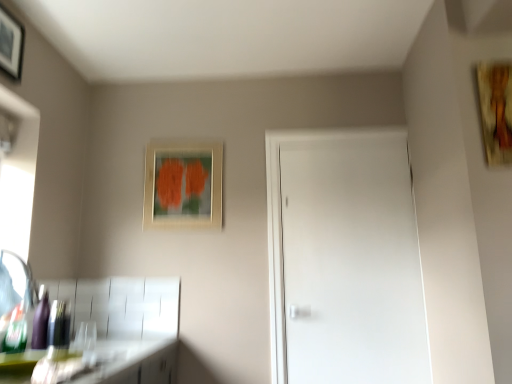
Question: From a real-world perspective, is brushed metal faucet at lower left physically above wooden picture frame at upper left, placed as the first picture frame when sorted from left to right?

Choices:
 (A) no
 (B) yes

Answer: (A)

Question: Considering the relative sizes of brushed metal faucet at lower left and wooden picture frame at upper left, the 3th picture frame positioned from the right, in the image provided, is brushed metal faucet at lower left bigger than wooden picture frame at upper left, the 3th picture frame positioned from the right,?

Choices:
 (A) no
 (B) yes

Answer: (B)

Question: Is brushed metal faucet at lower left directly adjacent to wooden picture frame at upper left, placed as the first picture frame when sorted from left to right?

Choices:
 (A) yes
 (B) no

Answer: (B)

Question: From the image's perspective, would you say brushed metal faucet at lower left is shown under wooden picture frame at upper left, which appears as the second picture frame when viewed from the back?

Choices:
 (A) yes
 (B) no

Answer: (A)

Question: Is brushed metal faucet at lower left outside of wooden picture frame at upper left, which appears as the second picture frame when viewed from the back?

Choices:
 (A) no
 (B) yes

Answer: (B)

Question: Does point (193, 211) appear closer or farther from the camera than point (270, 140)?

Choices:
 (A) closer
 (B) farther

Answer: (A)

Question: Which is correct: matte wooden picture frame at upper center, which appears as the second picture frame when viewed from the right, is inside white matte door at center, or outside of it?

Choices:
 (A) inside
 (B) outside

Answer: (B)

Question: From a real-world perspective, is matte wooden picture frame at upper center, placed as the 1th picture frame when sorted from back to front, physically located above or below white matte door at center?

Choices:
 (A) above
 (B) below

Answer: (A)

Question: From their relative heights in the image, would you say matte wooden picture frame at upper center, which appears as the second picture frame when viewed from the right, is taller or shorter than white matte door at center?

Choices:
 (A) short
 (B) tall

Answer: (A)

Question: Considering the positions of brushed metal faucet at lower left and wooden textured painting at upper right, arranged as the first picture frame when viewed from the right, in the image, is brushed metal faucet at lower left wider or thinner than wooden textured painting at upper right, arranged as the first picture frame when viewed from the right,?

Choices:
 (A) wide
 (B) thin

Answer: (A)

Question: From a real-world perspective, relative to wooden textured painting at upper right, which appears as the third picture frame when viewed from the left, is brushed metal faucet at lower left vertically above or below?

Choices:
 (A) below
 (B) above

Answer: (A)

Question: Would you say brushed metal faucet at lower left is to the left or to the right of wooden textured painting at upper right, arranged as the first picture frame when viewed from the right, in the picture?

Choices:
 (A) left
 (B) right

Answer: (A)

Question: In the image, is brushed metal faucet at lower left positioned in front of or behind wooden textured painting at upper right, arranged as the first picture frame when viewed from the right?

Choices:
 (A) front
 (B) behind

Answer: (A)

Question: In the image, is green matte countertop at lower left positioned in front of or behind white matte door at center?

Choices:
 (A) behind
 (B) front

Answer: (B)

Question: Would you say green matte countertop at lower left is to the left or to the right of white matte door at center in the picture?

Choices:
 (A) left
 (B) right

Answer: (A)